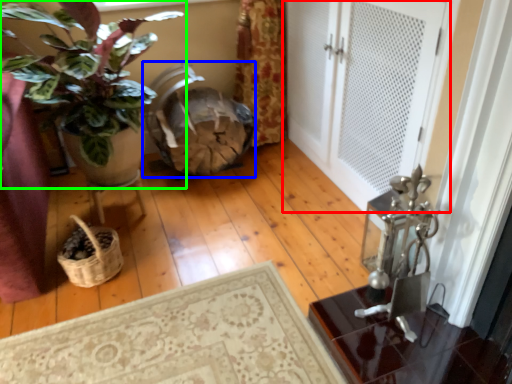
Question: Which is farther away from door (highlighted by a red box)? rocking chair (highlighted by a blue box) or houseplant (highlighted by a green box)?

Choices:
 (A) rocking chair
 (B) houseplant

Answer: (B)